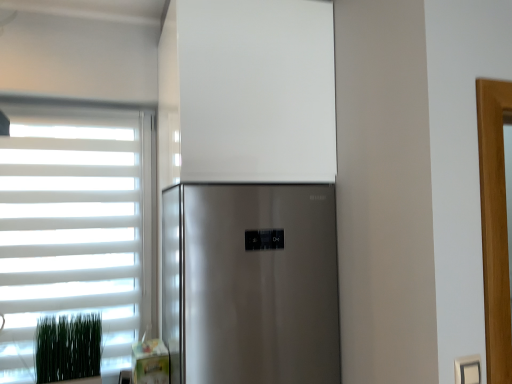
Question: Is green grass at lower left inside white plastic electric outlet at lower right?

Choices:
 (A) yes
 (B) no

Answer: (B)

Question: Is white plastic electric outlet at lower right positioned with its back to green grass at lower left?

Choices:
 (A) yes
 (B) no

Answer: (B)

Question: Is white plastic electric outlet at lower right at the left side of green grass at lower left?

Choices:
 (A) no
 (B) yes

Answer: (A)

Question: From the image's perspective, would you say white plastic electric outlet at lower right is shown under green grass at lower left?

Choices:
 (A) no
 (B) yes

Answer: (A)

Question: Is white plastic electric outlet at lower right smaller than green grass at lower left?

Choices:
 (A) yes
 (B) no

Answer: (A)

Question: Considering the positions of point (193, 294) and point (5, 281), is point (193, 294) closer or farther from the camera than point (5, 281)?

Choices:
 (A) closer
 (B) farther

Answer: (A)

Question: From the image's perspective, relative to white matte window at left, is satin silver refrigerator at center above or below?

Choices:
 (A) above
 (B) below

Answer: (B)

Question: In the image, is satin silver refrigerator at center on the left side or the right side of white matte window at left?

Choices:
 (A) right
 (B) left

Answer: (A)

Question: Considering the positions of satin silver refrigerator at center and white matte window at left in the image, is satin silver refrigerator at center wider or thinner than white matte window at left?

Choices:
 (A) wide
 (B) thin

Answer: (A)

Question: Would you say satin silver refrigerator at center is inside or outside green grass at lower left?

Choices:
 (A) outside
 (B) inside

Answer: (A)

Question: Is satin silver refrigerator at center wider or thinner than green grass at lower left?

Choices:
 (A) thin
 (B) wide

Answer: (B)

Question: Considering the positions of satin silver refrigerator at center and green grass at lower left in the image, is satin silver refrigerator at center taller or shorter than green grass at lower left?

Choices:
 (A) short
 (B) tall

Answer: (B)

Question: Considering the relative positions of satin silver refrigerator at center and green grass at lower left in the image provided, is satin silver refrigerator at center to the left or to the right of green grass at lower left?

Choices:
 (A) left
 (B) right

Answer: (B)

Question: Is green grass at lower left taller or shorter than satin silver refrigerator at center?

Choices:
 (A) short
 (B) tall

Answer: (A)

Question: Relative to satin silver refrigerator at center, is green grass at lower left in front or behind?

Choices:
 (A) behind
 (B) front

Answer: (A)